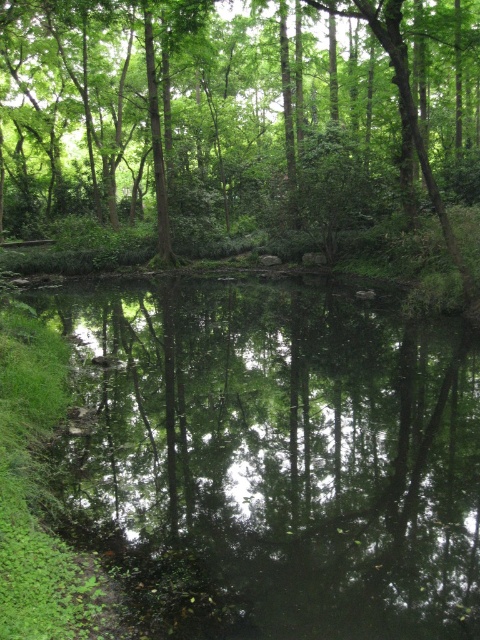
Consider the image. You are standing in the forest scene and want to place a small marker at both the point at coordinates (282,604) and the point at coordinates (35,214). Which point will appear closer to you when you look at the image?

The point at coordinates (282,604) is closer to the camera than the point at coordinates (35,214), so it will appear closer to you.

You are standing in the forest and see the green reflective water at center and the green leafy tree at center. Which object appears narrower in the image?

The green reflective water at center is thinner than the green leafy tree at center, so the green reflective water at center appears narrower.